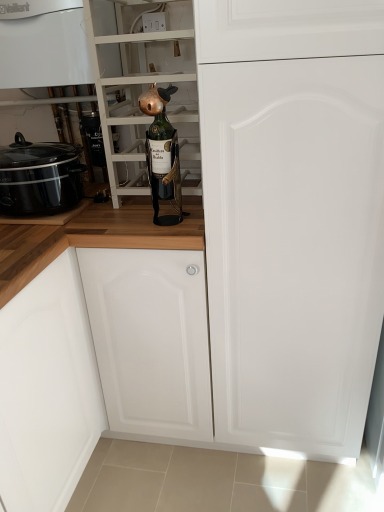
Question: Does point (182, 135) appear closer or farther from the camera than point (54, 75)?

Choices:
 (A) closer
 (B) farther

Answer: (B)

Question: Is green glass bottle at center inside the boundaries of white glossy boiler at upper left, or outside?

Choices:
 (A) outside
 (B) inside

Answer: (A)

Question: Estimate the real-world distances between objects in this image. Which object is farther from the white matte door at center?

Choices:
 (A) green glass bottle at center
 (B) white glossy boiler at upper left
 (C) green glass bottle at center
 (D) black glossy slow cooker at left

Answer: (B)

Question: Which object is positioned closest to the white matte door at center?

Choices:
 (A) green glass bottle at center
 (B) white glossy boiler at upper left
 (C) green glass bottle at center
 (D) black glossy slow cooker at left

Answer: (A)